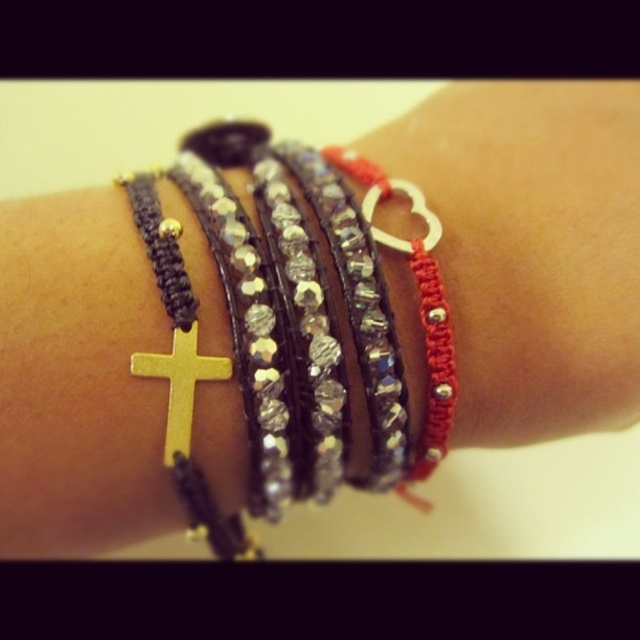
Who is more distant from viewer, (600, 100) or (176, 422)?

Point (600, 100)

Can you confirm if red beaded heart at center is positioned to the right of gold metallic cross at center?

Yes, red beaded heart at center is to the right of gold metallic cross at center.

Between point (451, 324) and point (184, 360), which one is positioned in front?

Positioned in front is point (184, 360).

The image size is (640, 640). I want to click on red beaded heart at center, so click(531, 250).